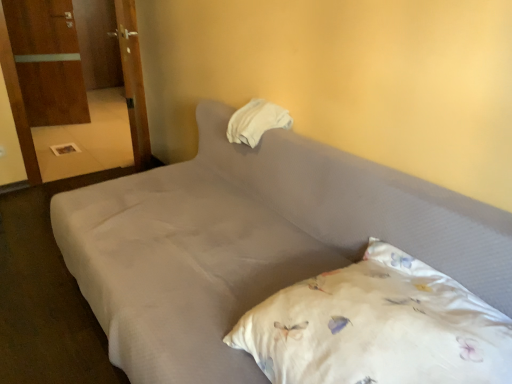
Question: From a real-world perspective, is white fabric pillow at upper center, acting as the 1th pillow starting from the back, under wooden armoire at left, the second armoire positioned from the front?

Choices:
 (A) no
 (B) yes

Answer: (A)

Question: Is wooden armoire at left, positioned as the second armoire in right-to-left order, at the back of white fabric pillow at upper center, acting as the 1th pillow starting from the back?

Choices:
 (A) no
 (B) yes

Answer: (A)

Question: Are white fabric pillow at upper center, acting as the 1th pillow starting from the back, and wooden armoire at left, the second armoire positioned from the front, making contact?

Choices:
 (A) no
 (B) yes

Answer: (A)

Question: Is white fabric pillow at upper center, acting as the 1th pillow starting from the back, smaller than wooden armoire at left, which is the 1th armoire from left to right?

Choices:
 (A) yes
 (B) no

Answer: (A)

Question: Is white fabric pillow at upper center, acting as the 1th pillow starting from the back, at the right side of wooden armoire at left, which is the 1th armoire from left to right?

Choices:
 (A) yes
 (B) no

Answer: (A)

Question: Considering the relative sizes of white fabric pillow at upper center, the second pillow from the front, and wooden armoire at left, positioned as the second armoire in right-to-left order, in the image provided, is white fabric pillow at upper center, the second pillow from the front, taller than wooden armoire at left, positioned as the second armoire in right-to-left order,?

Choices:
 (A) yes
 (B) no

Answer: (B)

Question: Is wooden door at upper left closer to the viewer compared to wooden door at left, the second armoire viewed from the back?

Choices:
 (A) yes
 (B) no

Answer: (A)

Question: Is wooden door at upper left turned away from wooden door at left, the second armoire viewed from the back?

Choices:
 (A) no
 (B) yes

Answer: (A)

Question: Could you tell me if wooden door at upper left is facing wooden door at left, marked as the first armoire in a right-to-left arrangement?

Choices:
 (A) no
 (B) yes

Answer: (B)

Question: Is wooden door at upper left surrounding wooden door at left, the 2th armoire when ordered from left to right?

Choices:
 (A) no
 (B) yes

Answer: (A)

Question: Is wooden door at upper left to the right of wooden door at left, the second armoire viewed from the back, from the viewer's perspective?

Choices:
 (A) yes
 (B) no

Answer: (A)

Question: From a real-world perspective, does wooden door at upper left sit lower than wooden door at left, the 2th armoire when ordered from left to right?

Choices:
 (A) no
 (B) yes

Answer: (A)

Question: Is white floral pillow at lower right, the second pillow in the top-to-bottom sequence, to the right of gray fabric bed at center from the viewer's perspective?

Choices:
 (A) no
 (B) yes

Answer: (B)